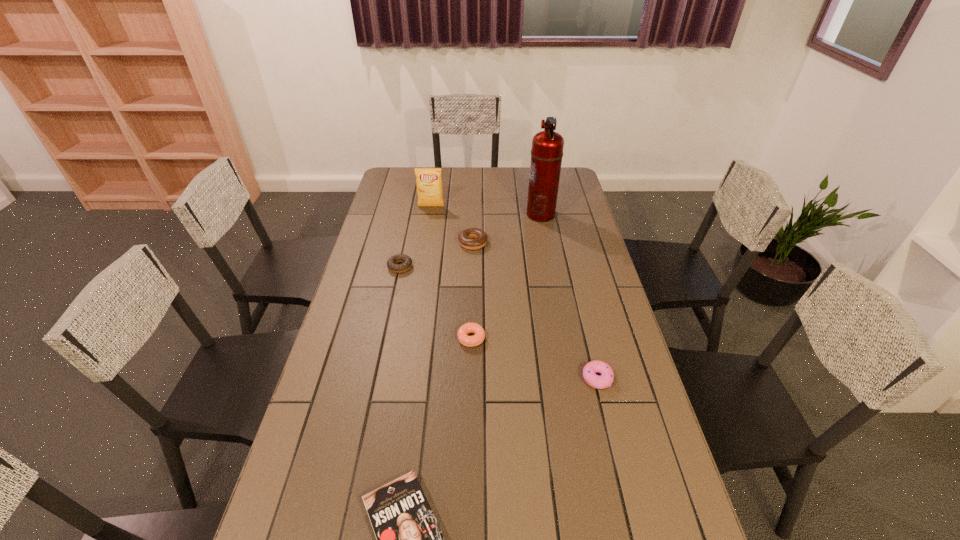
Find the location of a particular element. vacant region located 0.400m on the nozzle side of the fire extinguisher is located at coordinates (x=433, y=214).

Identify the location of vacant space located 0.240m on the front of the second tallest object with the logo. (425, 241).

Find the location of `vacant area located on the back of the farthest doughnut`. vacant area located on the back of the farthest doughnut is located at coordinates (473, 212).

In order to click on free space located 0.110m on the back of the second nearest object in this screenshot , I will do `click(588, 338)`.

Identify the location of vacant point located 0.130m on the back of the third nearest object. Image resolution: width=960 pixels, height=540 pixels. (472, 300).

Where is `free region located 0.120m on the front of the second farthest doughnut`? This screenshot has width=960, height=540. free region located 0.120m on the front of the second farthest doughnut is located at coordinates (394, 298).

Where is `object situated at the left edge`? This screenshot has height=540, width=960. object situated at the left edge is located at coordinates (392, 265).

You are a GUI agent. You are given a task and a screenshot of the screen. Output one action in this format:
    pyautogui.click(x=<x>, y=<y>)
    Task: Click on the fire extinguisher at the right edge
    
    Given the screenshot: What is the action you would take?
    pyautogui.click(x=547, y=146)

Find the location of a particular element. This screenshot has width=960, height=540. doughnut located at the right edge is located at coordinates (605, 380).

The width and height of the screenshot is (960, 540). I want to click on vacant space at the far edge of the desktop, so click(458, 177).